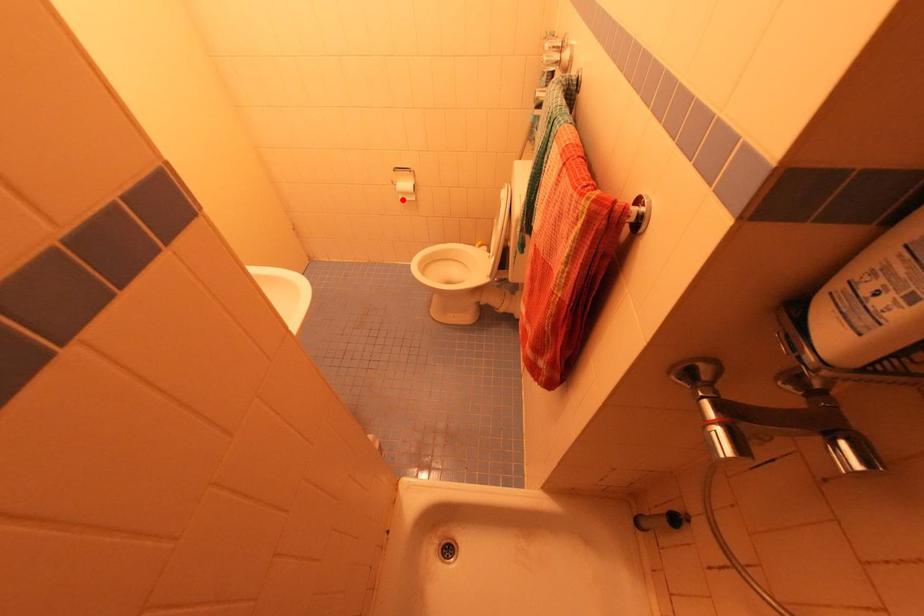
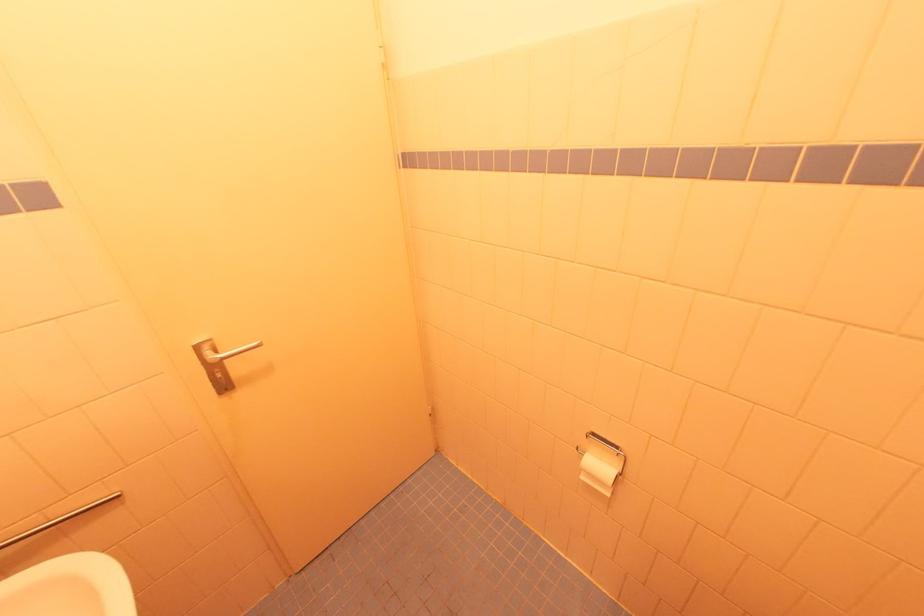
Where in the second image is the point corresponding to the highlighted location from the first image?

(585, 479)